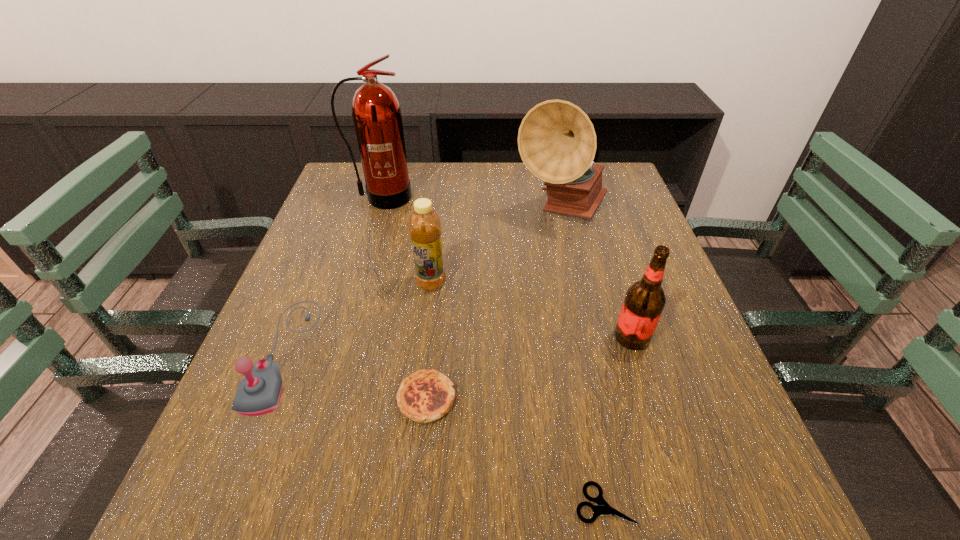
This screenshot has height=540, width=960. Find the location of `free space between the joystick and the third farthest object`. free space between the joystick and the third farthest object is located at coordinates (357, 318).

Where is `vacant area that lies between the phonograph record and the bottle`? The height and width of the screenshot is (540, 960). vacant area that lies between the phonograph record and the bottle is located at coordinates (496, 247).

The image size is (960, 540). What are the coordinates of `vacant space that's between the third shortest object and the third farthest object` in the screenshot? It's located at (357, 318).

The height and width of the screenshot is (540, 960). I want to click on vacant point located between the joystick and the quiche, so click(x=355, y=376).

Where is `vacant area that lies between the sixth tallest object and the fire extinguisher`? The image size is (960, 540). vacant area that lies between the sixth tallest object and the fire extinguisher is located at coordinates (404, 298).

Where is `empty space that is in between the joystick and the second shortest object`? Image resolution: width=960 pixels, height=540 pixels. empty space that is in between the joystick and the second shortest object is located at coordinates (355, 376).

You are a GUI agent. You are given a task and a screenshot of the screen. Output one action in this format:
    pyautogui.click(x=<x>, y=<y>)
    Task: Click on the free space between the root beer and the fire extinguisher
    
    Given the screenshot: What is the action you would take?
    pyautogui.click(x=507, y=267)

Where is `free space between the joystick and the root beer`? free space between the joystick and the root beer is located at coordinates pyautogui.click(x=458, y=345).

The image size is (960, 540). I want to click on vacant space in between the second shortest object and the root beer, so click(x=529, y=368).

Locate which object ranks fourth in proximity to the phonograph record. Please provide its 2D coordinates. Your answer should be formatted as a tuple, i.e. [(x, y)], where the tuple contains the x and y coordinates of a point satisfying the conditions above.

[(425, 396)]